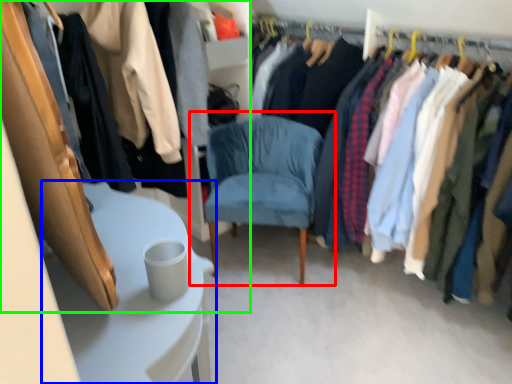
Question: Based on their relative distances, which object is farther from chair (highlighted by a red box)? Choose from table (highlighted by a blue box) and closet (highlighted by a green box).

Choices:
 (A) table
 (B) closet

Answer: (B)